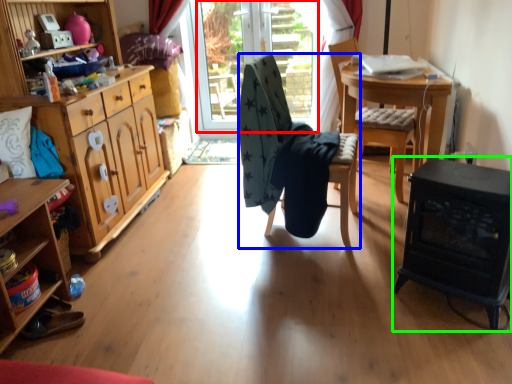
Question: Which object is positioned farthest from window screen (highlighted by a red box)? Select from chair (highlighted by a blue box) and fireplace (highlighted by a green box).

Choices:
 (A) chair
 (B) fireplace

Answer: (B)